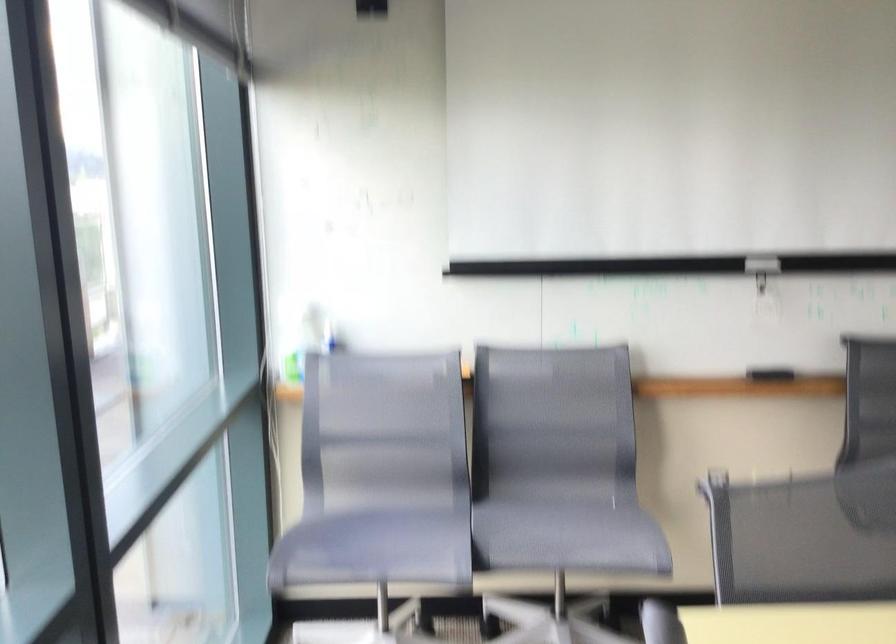
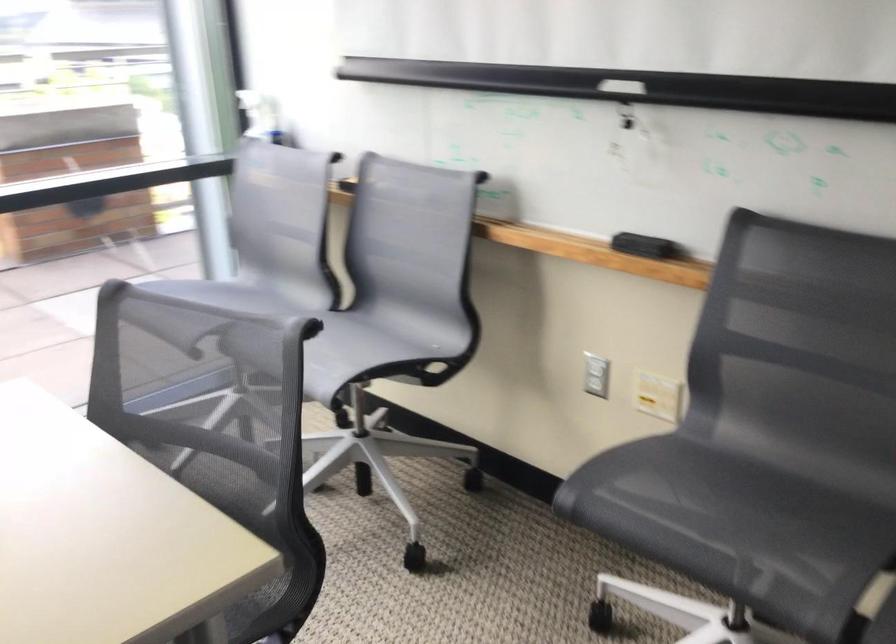
Locate, in the second image, the point that corresponds to pixel 785 375 in the first image.

(643, 245)